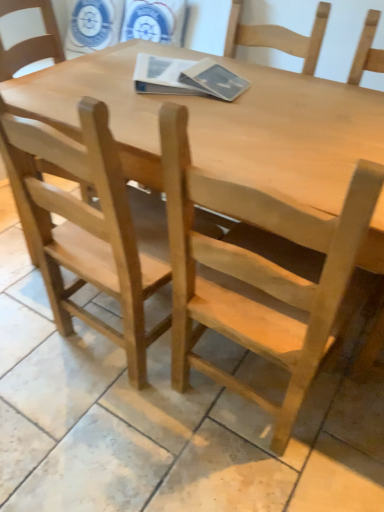
Question: In terms of width, does natural wood chair at center, placed as the first chair when sorted from right to left, look wider or thinner when compared to natural wood chair at left, the 1th chair in the left-to-right sequence?

Choices:
 (A) wide
 (B) thin

Answer: (B)

Question: From a real-world perspective, is natural wood chair at center, placed as the first chair when sorted from right to left, physically located above or below natural wood chair at left, the 2th chair viewed from the right?

Choices:
 (A) above
 (B) below

Answer: (A)

Question: Which of these objects is positioned farthest from the natural wood chair at center, the second chair from the left?

Choices:
 (A) natural wood chair at left, the 2th chair viewed from the right
 (B) natural wood table at center

Answer: (B)

Question: Based on their relative distances, which object is nearer to the natural wood table at center?

Choices:
 (A) natural wood chair at center, the second chair from the left
 (B) natural wood chair at left, the 2th chair viewed from the right

Answer: (A)